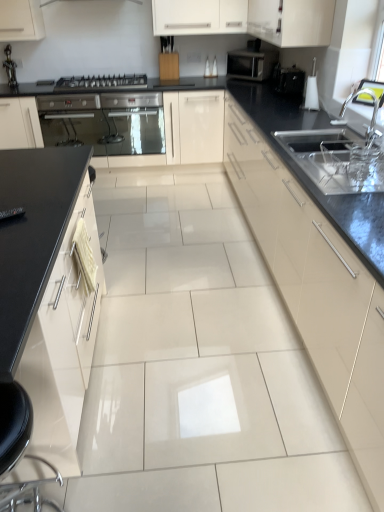
Find the location of a particular element. metallic stainless steel oven at left is located at coordinates (105, 122).

What do you see at coordinates (105, 122) in the screenshot? This screenshot has width=384, height=512. I see `metallic stainless steel oven at left` at bounding box center [105, 122].

Describe the element at coordinates (19, 448) in the screenshot. I see `black leather swivel chair at lower left` at that location.

This screenshot has width=384, height=512. In order to click on silver metallic faucet at upper right in this screenshot , I will do `click(372, 115)`.

Can you tell me how much black glossy toaster at upper right and silver metallic faucet at upper right differ in facing direction?

The facing directions of black glossy toaster at upper right and silver metallic faucet at upper right are 1.4 degrees apart.

From a real-world perspective, which is physically above, black glossy toaster at upper right or silver metallic faucet at upper right?

From a 3D spatial view, silver metallic faucet at upper right is above.

Is black glossy toaster at upper right spatially inside silver metallic faucet at upper right, or outside of it?

black glossy toaster at upper right is located beyond the bounds of silver metallic faucet at upper right.

From a real-world perspective, which is physically above, metallic stainless steel oven at left or matte cream cabinet at center, which appears as the second cabinetry when viewed from the right?

metallic stainless steel oven at left, from a real-world perspective.

Is metallic stainless steel oven at left inside the boundaries of matte cream cabinet at center, positioned as the third cabinetry in left-to-right order, or outside?

metallic stainless steel oven at left is spatially situated outside matte cream cabinet at center, positioned as the third cabinetry in left-to-right order.

From the image's perspective, which one is positioned higher, metallic stainless steel oven at left or matte cream cabinet at center, which appears as the second cabinetry when viewed from the right?

metallic stainless steel oven at left, from the image's perspective.

Based on their sizes in the image, would you say metallic stainless steel oven at left is bigger or smaller than matte cream cabinet at center, which appears as the second cabinetry when viewed from the right?

Considering their sizes, metallic stainless steel oven at left takes up less space than matte cream cabinet at center, which appears as the second cabinetry when viewed from the right.

Does point (299, 28) come farther from viewer compared to point (7, 499)?

Yes.

Can we say white glossy cabinet at upper center, the fourth cabinetry from the left, lies outside black leather swivel chair at lower left?

Absolutely, white glossy cabinet at upper center, the fourth cabinetry from the left, is external to black leather swivel chair at lower left.

Does white glossy cabinet at upper center, acting as the 1th cabinetry starting from the right, have a greater height compared to black leather swivel chair at lower left?

In fact, white glossy cabinet at upper center, acting as the 1th cabinetry starting from the right, may be shorter than black leather swivel chair at lower left.

Is white glossy cabinet at upper center, the fourth cabinetry from the left, at the right side of black leather swivel chair at lower left?

Yes.

From a real-world perspective, who is located higher, black glossy toaster at upper right or black leather swivel chair at lower left?

black glossy toaster at upper right is physically above.

How much distance is there between black glossy toaster at upper right and black leather swivel chair at lower left?

10.42 feet.

Is black glossy toaster at upper right oriented away from black leather swivel chair at lower left?

No.

Is black leather swivel chair at lower left surrounded by black glossy toaster at upper right?

That's incorrect, black leather swivel chair at lower left is not inside black glossy toaster at upper right.

Between white glossy cabinet at left, which ranks as the first cabinetry in left-to-right order, and black leather swivel chair at lower left, which one has larger size?

Bigger between the two is white glossy cabinet at left, which ranks as the first cabinetry in left-to-right order.

Considering the sizes of objects white glossy cabinet at left, which ranks as the 4th cabinetry in right-to-left order, and black leather swivel chair at lower left in the image provided, who is shorter, white glossy cabinet at left, which ranks as the 4th cabinetry in right-to-left order, or black leather swivel chair at lower left?

Standing shorter between the two is black leather swivel chair at lower left.

Does point (41, 423) lie in front of point (10, 499)?

Yes, point (41, 423) is in front of point (10, 499).

From the picture: Are white glossy cabinet at left, which ranks as the first cabinetry in left-to-right order, and black leather swivel chair at lower left located far from each other?

white glossy cabinet at left, which ranks as the first cabinetry in left-to-right order, is near black leather swivel chair at lower left, not far away.

Which is behind, matte cream cabinet at center, positioned as the third cabinetry in left-to-right order, or black glossy toaster at upper right?

black glossy toaster at upper right.

How far apart are matte cream cabinet at center, positioned as the third cabinetry in left-to-right order, and black glossy toaster at upper right?

They are 4.73 feet apart.

Can you tell me how much matte cream cabinet at center, positioned as the third cabinetry in left-to-right order, and black glossy toaster at upper right differ in facing direction?

matte cream cabinet at center, positioned as the third cabinetry in left-to-right order, and black glossy toaster at upper right are facing 0.4 degrees away from each other.

From a real-world perspective, is matte cream cabinet at center, which appears as the second cabinetry when viewed from the right, located higher than black glossy toaster at upper right?

No, from a real-world perspective, matte cream cabinet at center, which appears as the second cabinetry when viewed from the right, is not over black glossy toaster at upper right

Considering the sizes of objects white glossy cabinet at upper center, the fourth cabinetry from the left, and matte black microwave at upper right in the image provided, who is wider, white glossy cabinet at upper center, the fourth cabinetry from the left, or matte black microwave at upper right?

white glossy cabinet at upper center, the fourth cabinetry from the left.

From the image's perspective, does white glossy cabinet at upper center, the fourth cabinetry from the left, appear lower than matte black microwave at upper right?

No, from the image's perspective, white glossy cabinet at upper center, the fourth cabinetry from the left, is not below matte black microwave at upper right.

Which is more to the left, white glossy cabinet at upper center, the fourth cabinetry from the left, or matte black microwave at upper right?

matte black microwave at upper right is more to the left.

Does white glossy cabinet at upper center, acting as the 1th cabinetry starting from the right, contain matte black microwave at upper right?

Actually, matte black microwave at upper right is outside white glossy cabinet at upper center, acting as the 1th cabinetry starting from the right.

Locate an element on the screen. appliance that appears behind the silver metallic faucet at upper right is located at coordinates (290, 81).

At what (x,y) coordinates should I click in order to perform the action: click on home appliance above the matte cream cabinet at center, positioned as the third cabinetry in left-to-right order (from a real-world perspective). Please return your answer as a coordinate pair (x, y). Looking at the image, I should click on (105, 122).

When comparing their distances from white glossy cabinet at upper center, the fourth cabinetry from the left, does black leather swivel chair at lower left or matte cream cabinet at center, which appears as the second cabinetry when viewed from the right, seem further?

Based on the image, black leather swivel chair at lower left appears to be further to white glossy cabinet at upper center, the fourth cabinetry from the left.

Estimate the real-world distances between objects in this image. Which object is closer to metallic stainless steel oven at left, white glossy cabinet at left, which ranks as the 4th cabinetry in right-to-left order, or matte black microwave at upper right?

The object closer to metallic stainless steel oven at left is matte black microwave at upper right.

Looking at the image, which one is located further to black glossy toaster at upper right, white glossy cabinet at left, which ranks as the 4th cabinetry in right-to-left order, or matte cream cabinet at center, which appears as the second cabinetry when viewed from the right?

Based on the image, white glossy cabinet at left, which ranks as the 4th cabinetry in right-to-left order, appears to be further to black glossy toaster at upper right.

From the image, which object appears to be farther from matte black microwave at upper right, matte cream cabinet at center, positioned as the third cabinetry in left-to-right order, or silver metallic faucet at upper right?

matte cream cabinet at center, positioned as the third cabinetry in left-to-right order, is further to matte black microwave at upper right.

When comparing their distances from white glossy cabinet at left, which ranks as the 4th cabinetry in right-to-left order, does matte black microwave at upper right or metallic stainless steel oven at left seem closer?

metallic stainless steel oven at left lies closer to white glossy cabinet at left, which ranks as the 4th cabinetry in right-to-left order, than the other object.

From the image, which object appears to be farther from metallic silver gas stove at center-left, silver metallic faucet at upper right or matte cream cabinet at center, positioned as the third cabinetry in left-to-right order?

silver metallic faucet at upper right lies further to metallic silver gas stove at center-left than the other object.

Looking at the image, which one is located closer to black glossy toaster at upper right, metallic silver gas stove at center-left or matte cream cabinet at center, positioned as the third cabinetry in left-to-right order?

Among the two, matte cream cabinet at center, positioned as the third cabinetry in left-to-right order, is located nearer to black glossy toaster at upper right.

Estimate the real-world distances between objects in this image. Which object is closer to white glossy cabinet at left, which ranks as the first cabinetry in left-to-right order, silver metallic faucet at upper right or matte cream cabinet at center, which appears as the second cabinetry when viewed from the right?

matte cream cabinet at center, which appears as the second cabinetry when viewed from the right, is positioned closer to the anchor white glossy cabinet at left, which ranks as the first cabinetry in left-to-right order.

Where is `appliance between metallic silver gas stove at center-left and silver metallic faucet at upper right`? Image resolution: width=384 pixels, height=512 pixels. appliance between metallic silver gas stove at center-left and silver metallic faucet at upper right is located at coordinates (290, 81).

At what (x,y) coordinates should I click in order to perform the action: click on kitchen appliance between metallic silver gas stove at center-left and black glossy toaster at upper right from left to right. Please return your answer as a coordinate pair (x, y). Image resolution: width=384 pixels, height=512 pixels. Looking at the image, I should click on (251, 64).

Locate an element on the screen. gas stove between metallic stainless steel oven at left and matte black microwave at upper right from left to right is located at coordinates (103, 82).

At what (x,y) coordinates should I click in order to perform the action: click on gas stove between metallic stainless steel oven at left and silver metallic faucet at upper right in the horizontal direction. Please return your answer as a coordinate pair (x, y). Image resolution: width=384 pixels, height=512 pixels. Looking at the image, I should click on (103, 82).